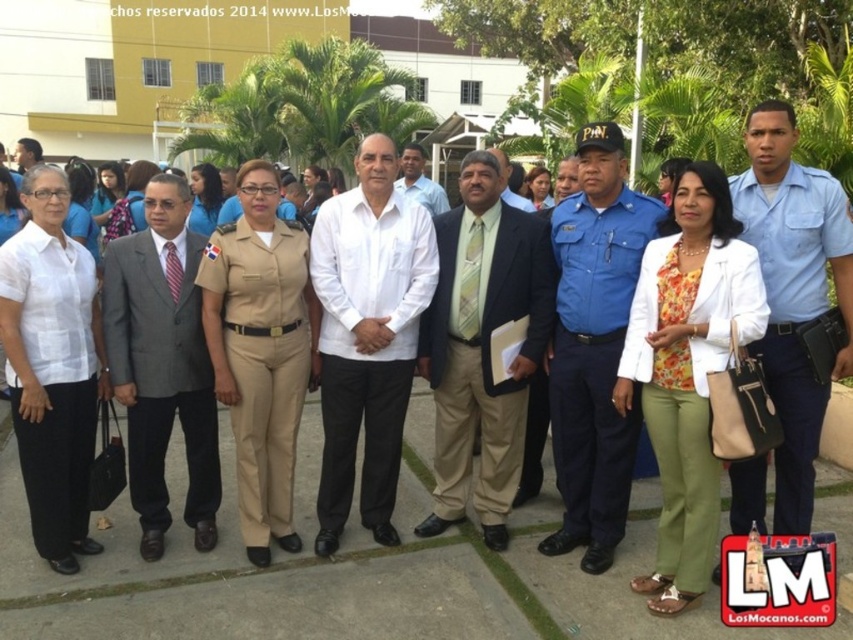
Consider the image. Is tan uniform at center in front of matte black suit at left?

Yes, it is.

Who is more distant from viewer, (259, 406) or (36, 141)?

The point (36, 141) is behind.

Identify the location of tan uniform at center. This screenshot has height=640, width=853. (260, 352).

Can you confirm if light brown suit at center is wider than blue uniform at center?

Indeed, light brown suit at center has a greater width compared to blue uniform at center.

This screenshot has height=640, width=853. Describe the element at coordinates (482, 346) in the screenshot. I see `light brown suit at center` at that location.

Which is in front, point (498, 435) or point (575, 237)?

Point (575, 237) is in front.

This screenshot has width=853, height=640. I want to click on light brown suit at center, so click(x=482, y=346).

Who is lower down, white matte shirt at center or matte black suit at left?

white matte shirt at center is below.

Who is more forward, [323,477] or [22,156]?

Positioned in front is point [323,477].

Locate an element on the screen. This screenshot has height=640, width=853. white matte shirt at center is located at coordinates (367, 336).